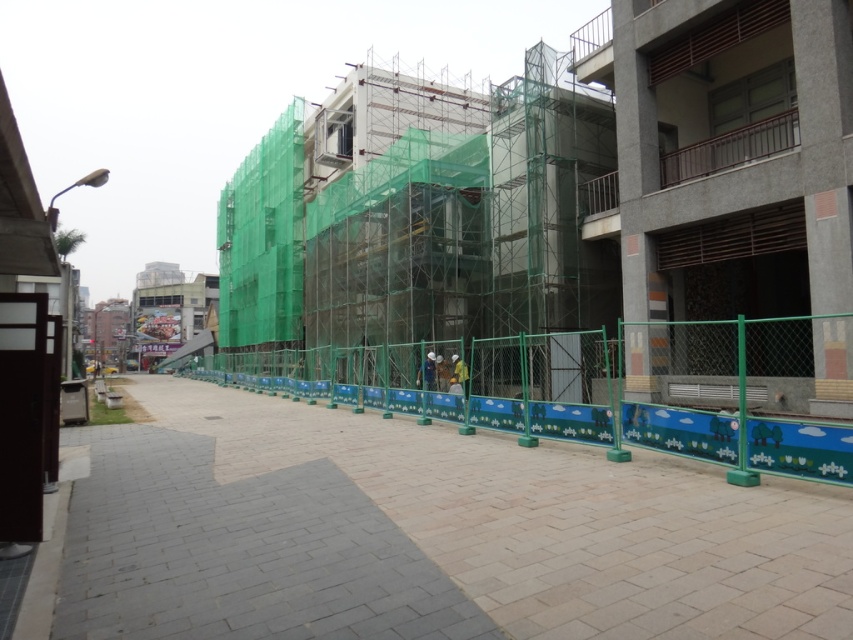
Who is positioned more to the left, brick pavement at center or green plastic fence at center?

brick pavement at center

Is the position of brick pavement at center more distant than that of green plastic fence at center?

No, it is in front of green plastic fence at center.

Image resolution: width=853 pixels, height=640 pixels. I want to click on brick pavement at center, so click(x=426, y=532).

Is green plastic fence at center wider than blue fabric construction worker at center?

Yes, green plastic fence at center is wider than blue fabric construction worker at center.

Can you confirm if green plastic fence at center is taller than blue fabric construction worker at center?

Indeed, green plastic fence at center has a greater height compared to blue fabric construction worker at center.

I want to click on green plastic fence at center, so click(587, 388).

This screenshot has width=853, height=640. In order to click on green plastic fence at center in this screenshot , I will do click(587, 388).

Who is positioned more to the right, brick pavement at center or green mesh scaffolding at center?

Positioned to the right is brick pavement at center.

Can you confirm if brick pavement at center is taller than green mesh scaffolding at center?

No, brick pavement at center is not taller than green mesh scaffolding at center.

Locate an element on the screen. The image size is (853, 640). brick pavement at center is located at coordinates (426, 532).